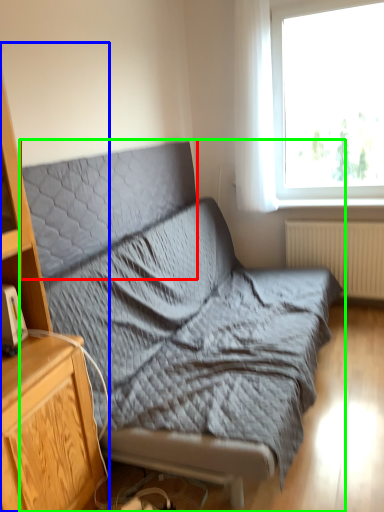
Question: Which object is positioned farthest from pillow (highlighted by a red box)? Select from cabinetry (highlighted by a blue box) and studio couch (highlighted by a green box).

Choices:
 (A) cabinetry
 (B) studio couch

Answer: (A)